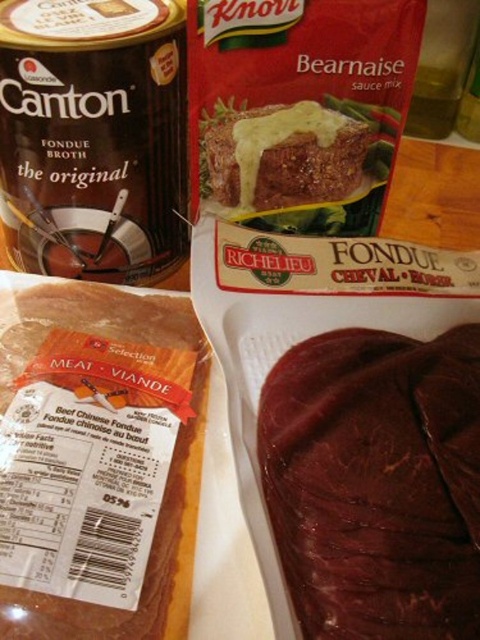
Does brown glossy meat at center have a larger size compared to dark brown glossy meat at lower right?

Yes.

Who is lower down, brown glossy meat at center or dark brown glossy meat at lower right?

dark brown glossy meat at lower right is below.

Does point (43, 472) lie in front of point (464, 474)?

No, it is not.

At what (x,y) coordinates should I click in order to perform the action: click on brown glossy meat at center. Please return your answer as a coordinate pair (x, y). The image size is (480, 640). Looking at the image, I should click on (97, 460).